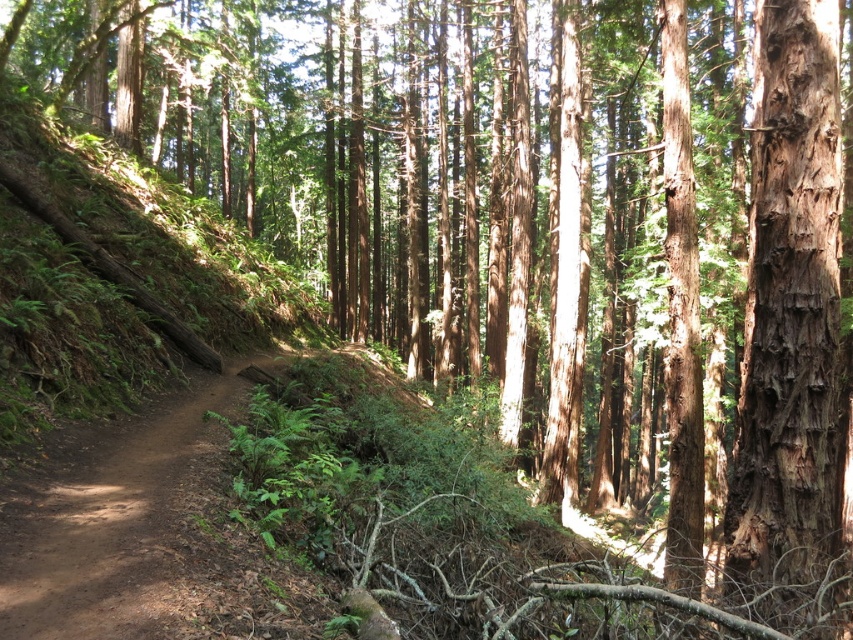
From the picture: You are a hiker trying to follow the brown dirt track at center in the forest. There is a rough bark tree trunk at right nearby. Which one is bigger in size?

The rough bark tree trunk at right has a larger size compared to the brown dirt track at center.

You are a hiker walking along the narrow dirt path in the forest scene. You notice the rough bark tree trunk at right and the brown dirt track at center. Which object is closer to you as you walk on the path?

The rough bark tree trunk at right is closer to you because it is in front of the brown dirt track at center, indicating it is nearer in the line of sight.

You are a hiker trying to follow the brown dirt track at center through the forest. As you walk, you notice the rough bark tree trunk at right. Which side of the path should you keep the tree on to stay on the correct path?

To stay on the correct path, you should keep the rough bark tree trunk at right on your right side since it is positioned on the right side of the brown dirt track at center.